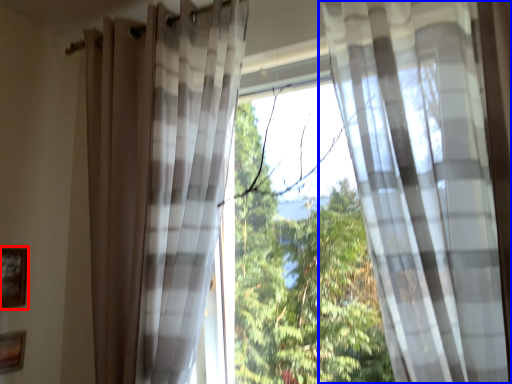
Question: Among these objects, which one is farthest to the camera, picture frame (highlighted by a red box) or curtain (highlighted by a blue box)?

Choices:
 (A) picture frame
 (B) curtain

Answer: (A)